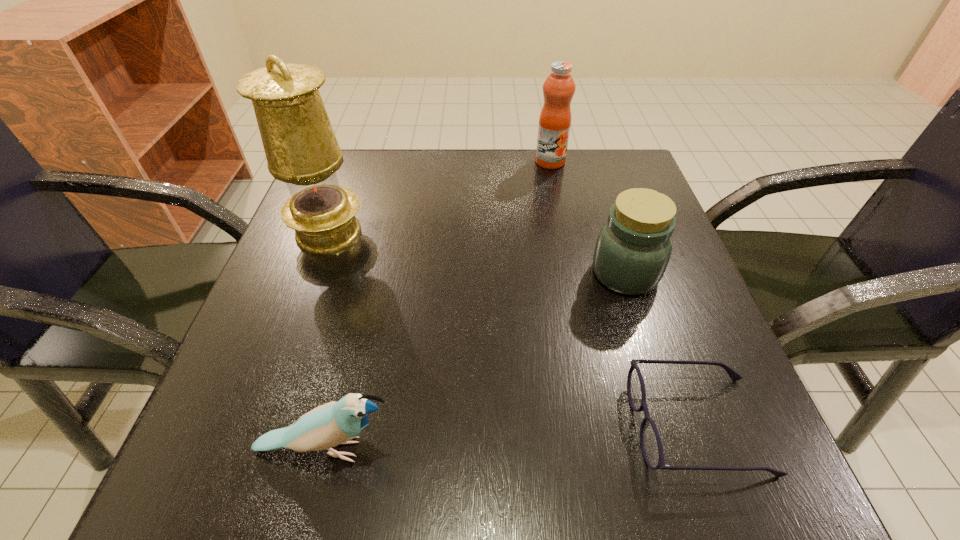
The image size is (960, 540). In order to click on the tallest object in this screenshot , I will do `click(301, 149)`.

Locate an element on the screen. the farthest object is located at coordinates (559, 87).

Locate an element on the screen. This screenshot has height=540, width=960. the fourth shortest object is located at coordinates (559, 87).

You are a GUI agent. You are given a task and a screenshot of the screen. Output one action in this format:
    pyautogui.click(x=<x>, y=<y>)
    Task: Click on the jar
    
    Given the screenshot: What is the action you would take?
    pyautogui.click(x=633, y=248)

Identify the location of bird. (334, 423).

I want to click on spectacles, so click(x=651, y=446).

This screenshot has width=960, height=540. Identify the location of vacant space located on the right of the oil lamp. (400, 233).

This screenshot has height=540, width=960. Find the location of `vacant space located 0.210m on the front label of the fruit juice`. vacant space located 0.210m on the front label of the fruit juice is located at coordinates click(564, 227).

Find the location of a particular element. free space located 0.320m on the front of the jar is located at coordinates (696, 497).

I want to click on free space located at the face of the bird, so point(704,449).